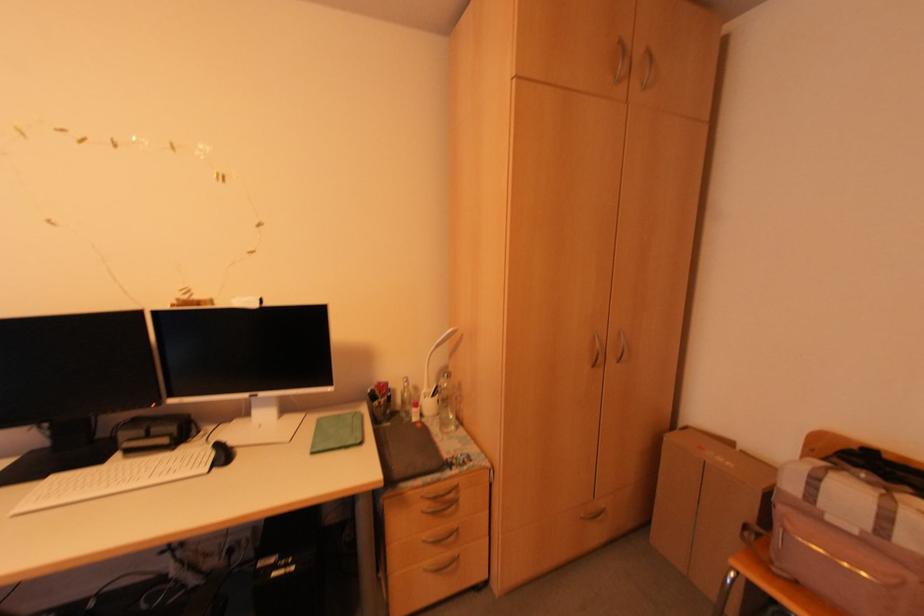
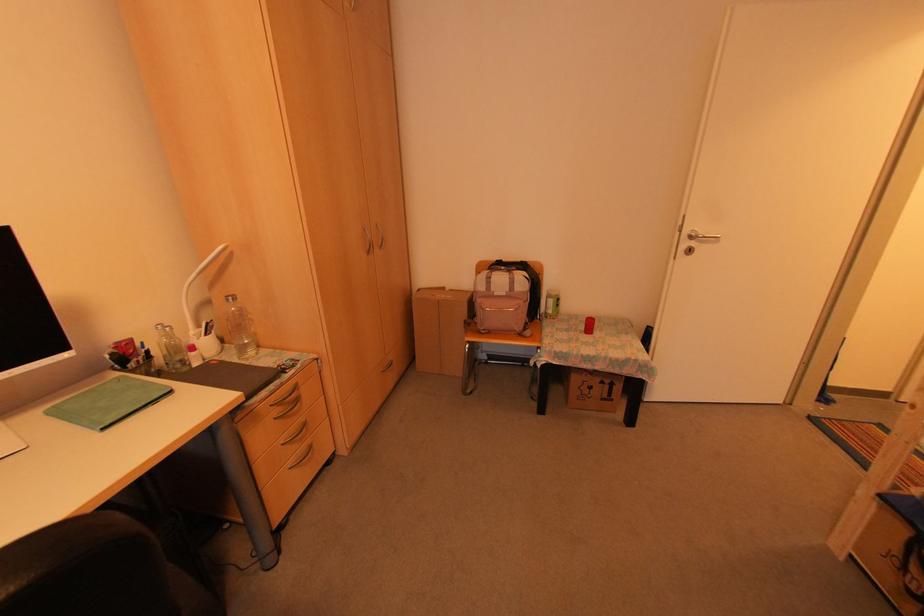
Where in the second image is the point corresponding to point (602, 506) from the first image?

(388, 359)